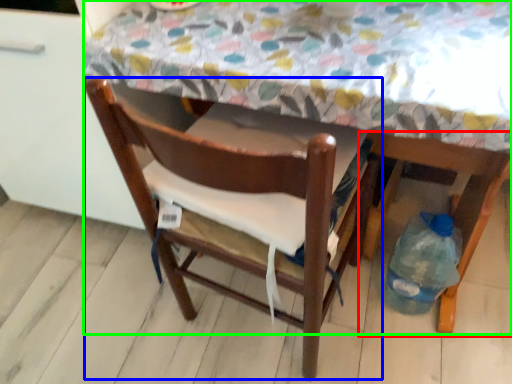
Question: Considering the real-world distances, which object is closest to chair (highlighted by a red box)? chair (highlighted by a blue box) or table (highlighted by a green box).

Choices:
 (A) chair
 (B) table

Answer: (A)